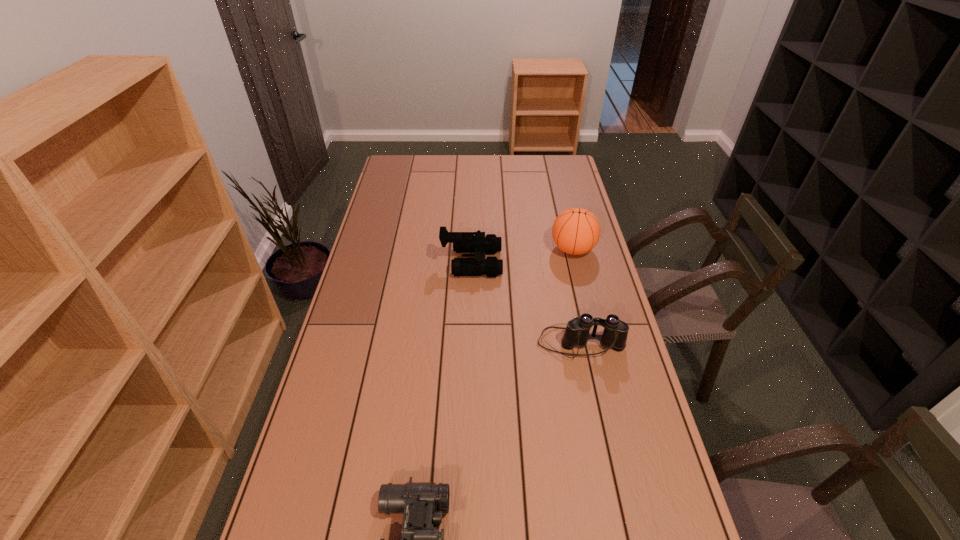
Identify which object is the second closest to the nearest binoculars. Please provide its 2D coordinates. Your answer should be formatted as a tuple, i.e. [(x, y)], where the tuple contains the x and y coordinates of a point satisfying the conditions above.

[(463, 242)]

The height and width of the screenshot is (540, 960). I want to click on object that stands as the closest to the shortest binoculars, so click(614, 336).

You are a GUI agent. You are given a task and a screenshot of the screen. Output one action in this format:
    pyautogui.click(x=<x>, y=<y>)
    Task: Click on the binoculars that stands as the closest to the nearest object
    This screenshot has height=540, width=960.
    Given the screenshot: What is the action you would take?
    (614, 336)

Point out which binoculars is positioned as the nearest to the basketball. Please provide its 2D coordinates. Your answer should be formatted as a tuple, i.e. [(x, y)], where the tuple contains the x and y coordinates of a point satisfying the conditions above.

[(463, 242)]

You are a GUI agent. You are given a task and a screenshot of the screen. Output one action in this format:
    pyautogui.click(x=<x>, y=<y>)
    Task: Click on the free space that satisfies the following two spatial constraints: 1. on the front lenses of the third farthest object; 2. on the right side of the farthest binoculars
    This screenshot has height=540, width=960.
    Given the screenshot: What is the action you would take?
    pyautogui.click(x=469, y=343)

Where is `vacant region that satisfies the following two spatial constraints: 1. on the front lenses of the farthest binoculars; 2. on the right side of the second farthest binoculars`? The width and height of the screenshot is (960, 540). vacant region that satisfies the following two spatial constraints: 1. on the front lenses of the farthest binoculars; 2. on the right side of the second farthest binoculars is located at coordinates (469, 343).

You are a GUI agent. You are given a task and a screenshot of the screen. Output one action in this format:
    pyautogui.click(x=<x>, y=<y>)
    Task: Click on the vacant space that satisfies the following two spatial constraints: 1. on the back side of the third farthest object; 2. on the front lenses of the farthest binoculars
    
    Given the screenshot: What is the action you would take?
    pyautogui.click(x=564, y=262)